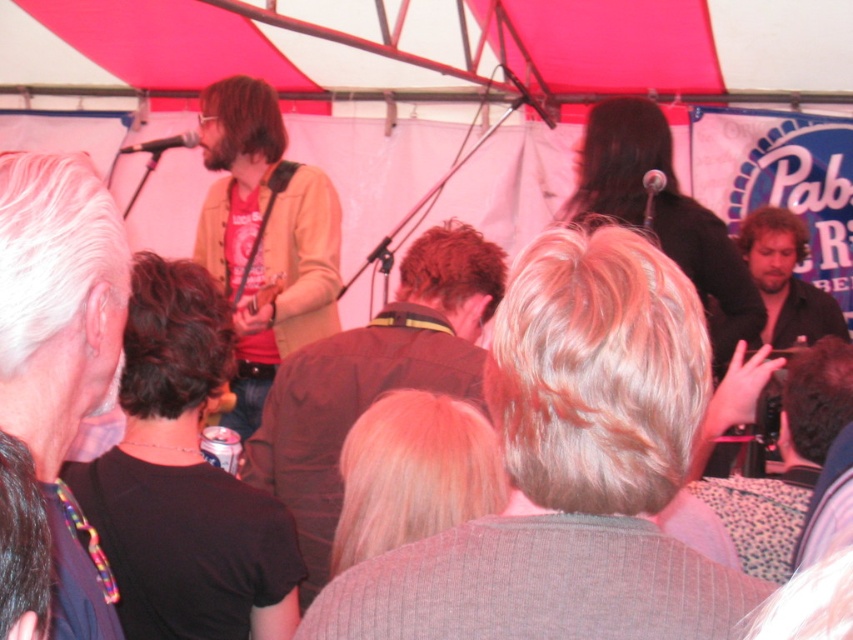
Measure the distance between blonde hair at center and camera.

The distance of blonde hair at center from camera is 29.28 inches.

Between blonde hair at center and brown leather jacket at center, which one is positioned lower?

brown leather jacket at center is lower down.

At what (x,y) coordinates should I click in order to perform the action: click on blonde hair at center. Please return your answer as a coordinate pair (x, y). Image resolution: width=853 pixels, height=640 pixels. Looking at the image, I should click on (570, 468).

This screenshot has height=640, width=853. Identify the location of blonde hair at center. (570, 468).

Is brown leather jacket at center closer to the viewer compared to matte brown jacket at center?

Yes, brown leather jacket at center is closer to the viewer.

Does brown leather jacket at center appear on the left side of matte brown jacket at center?

In fact, brown leather jacket at center is to the right of matte brown jacket at center.

Does point (258, 460) lie in front of point (271, 202)?

Yes, it is in front of point (271, 202).

Find the location of a particular element. This screenshot has width=853, height=640. brown leather jacket at center is located at coordinates (373, 380).

Does point (3, 374) come farther from viewer compared to point (474, 317)?

No.

Does point (114, 376) come closer to viewer compared to point (318, 460)?

Yes.

Identify the location of gray hair at left. The width and height of the screenshot is (853, 640). (61, 349).